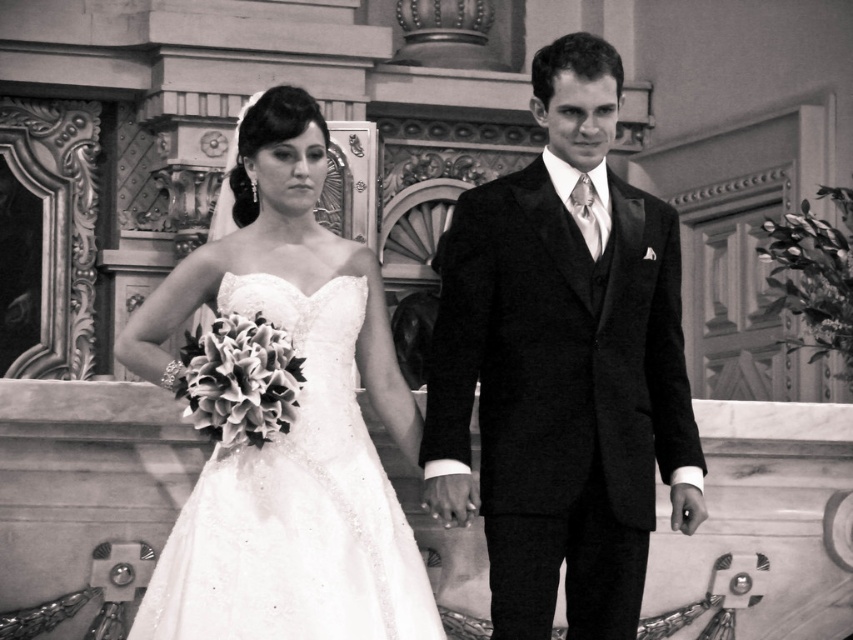
You are a photographer standing at the camera position. You want to capture a closeup shot of the smooth black suit at center. Given that your camera can focus on objects within 10 meters, will you be able to take the closeup shot?

The distance between the smooth black suit at center and the camera is 18.32 meters, which is beyond the camera focus range of 10 meters. Therefore, you cannot take the closeup shot.

You are a photographer standing at the back of the venue. You want to take a photo of the smooth black suit at center and the satin dress at center. The camera you are using has a maximum focus range of 4 meters. Can you capture both subjects in focus without moving closer?

The smooth black suit at center is 4.36 meters away from the satin dress at center. Since the camera can only focus up to 4 meters, the distance between them exceeds the camera range. Therefore, you cannot capture both in focus without moving closer.

You are a photographer standing at the center of the aisle in the wedding scene. You want to take a photo that includes both the point at coordinate point (657, 401) and point (392, 410). Which point is closer to your camera lens?

Point (657, 401) is further to the viewer than point (392, 410), so the point closer to the camera lens is point (392, 410).